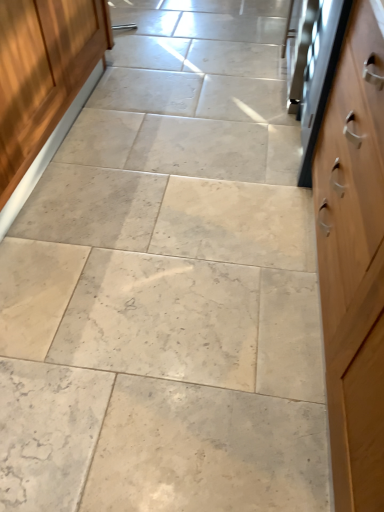
Question: Is point (44, 66) closer or farther from the camera than point (304, 88)?

Choices:
 (A) farther
 (B) closer

Answer: (B)

Question: Considering their positions, is wooden cabinet at left located in front of or behind satin silver oven at right?

Choices:
 (A) behind
 (B) front

Answer: (B)

Question: Considering the positions of wooden cabinet at left and satin silver oven at right in the image, is wooden cabinet at left wider or thinner than satin silver oven at right?

Choices:
 (A) thin
 (B) wide

Answer: (B)

Question: Is satin silver oven at right in front of or behind wooden cabinet at left in the image?

Choices:
 (A) front
 (B) behind

Answer: (B)

Question: From a real-world perspective, is satin silver oven at right physically located above or below wooden cabinet at left?

Choices:
 (A) below
 (B) above

Answer: (B)

Question: From the image's perspective, relative to wooden cabinet at left, is satin silver oven at right above or below?

Choices:
 (A) below
 (B) above

Answer: (B)

Question: Considering the positions of satin silver oven at right and wooden cabinet at left in the image, is satin silver oven at right wider or thinner than wooden cabinet at left?

Choices:
 (A) wide
 (B) thin

Answer: (B)